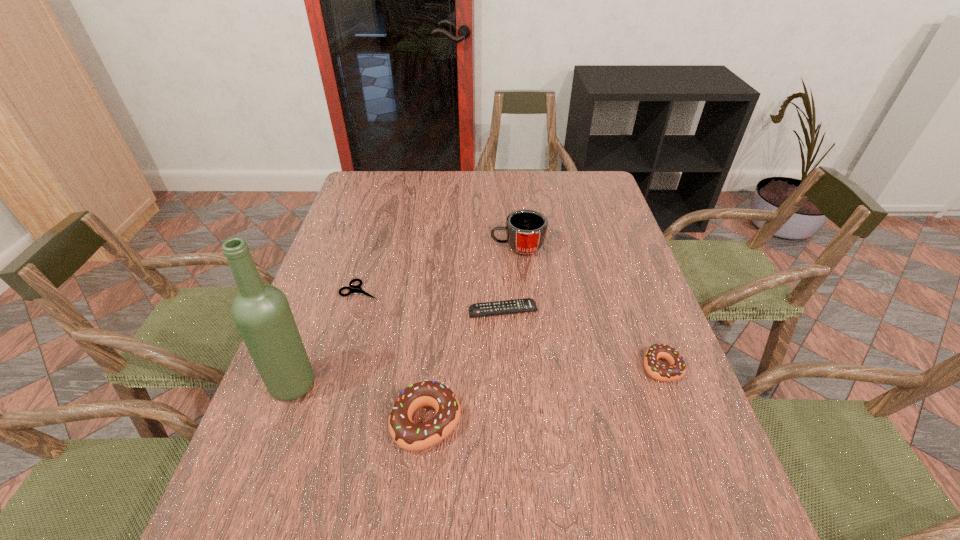
Where is `free space between the second shortest object and the shears`? This screenshot has width=960, height=540. free space between the second shortest object and the shears is located at coordinates tap(432, 300).

The image size is (960, 540). Find the location of `vacant region between the wine bottle and the fourth object from right to left`. vacant region between the wine bottle and the fourth object from right to left is located at coordinates (360, 403).

The height and width of the screenshot is (540, 960). I want to click on vacant area that lies between the shortest object and the tallest object, so click(327, 337).

You are a GUI agent. You are given a task and a screenshot of the screen. Output one action in this format:
    pyautogui.click(x=<x>, y=<y>)
    Task: Click on the free space between the fifth tallest object and the tallest object
    The height and width of the screenshot is (540, 960).
    Given the screenshot: What is the action you would take?
    pyautogui.click(x=398, y=347)

Locate an element on the screen. This screenshot has height=540, width=960. free space between the second farthest object and the fourth nearest object is located at coordinates (432, 300).

Where is `free space between the wine bottle and the third farthest object`? The height and width of the screenshot is (540, 960). free space between the wine bottle and the third farthest object is located at coordinates (398, 347).

Find the location of a particular element. This screenshot has width=960, height=540. empty space that is in between the shortest object and the taller doughnut is located at coordinates pyautogui.click(x=394, y=356).

Locate an element on the screen. empty space that is in between the shears and the wine bottle is located at coordinates (327, 337).

Image resolution: width=960 pixels, height=540 pixels. I want to click on free area in between the fifth tallest object and the mug, so pos(511,279).

At what (x,y) coordinates should I click in order to perform the action: click on the closest object to the fifth shortest object. Please return your answer as a coordinate pair (x, y). The width and height of the screenshot is (960, 540). Looking at the image, I should click on (528, 304).